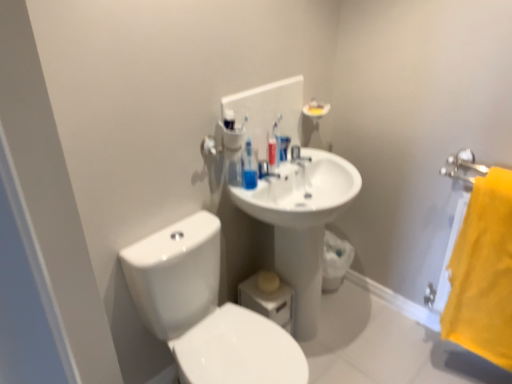
Question: Considering the relative sizes of yellow fabric towel at right and translucent plastic toothbrushes at upper center in the image provided, is yellow fabric towel at right bigger than translucent plastic toothbrushes at upper center?

Choices:
 (A) yes
 (B) no

Answer: (A)

Question: Is yellow fabric towel at right facing away from translucent plastic toothbrushes at upper center?

Choices:
 (A) yes
 (B) no

Answer: (B)

Question: Considering the relative sizes of yellow fabric towel at right and translucent plastic toothbrushes at upper center in the image provided, is yellow fabric towel at right wider than translucent plastic toothbrushes at upper center?

Choices:
 (A) yes
 (B) no

Answer: (A)

Question: Can you confirm if yellow fabric towel at right is shorter than translucent plastic toothbrushes at upper center?

Choices:
 (A) yes
 (B) no

Answer: (B)

Question: Considering the relative sizes of yellow fabric towel at right and translucent plastic toothbrushes at upper center in the image provided, is yellow fabric towel at right taller than translucent plastic toothbrushes at upper center?

Choices:
 (A) yes
 (B) no

Answer: (A)

Question: Is translucent plastic toothbrushes at upper center wider or thinner than white glossy sink at center?

Choices:
 (A) thin
 (B) wide

Answer: (A)

Question: In the image, is translucent plastic toothbrushes at upper center on the left side or the right side of white glossy sink at center?

Choices:
 (A) right
 (B) left

Answer: (B)

Question: From the image's perspective, relative to white glossy sink at center, is translucent plastic toothbrushes at upper center above or below?

Choices:
 (A) below
 (B) above

Answer: (A)

Question: Considering the positions of translucent plastic toothbrushes at upper center and white glossy sink at center in the image, is translucent plastic toothbrushes at upper center taller or shorter than white glossy sink at center?

Choices:
 (A) tall
 (B) short

Answer: (A)

Question: Is blue plastic mouthwash at center in front of or behind white glossy sink at center in the image?

Choices:
 (A) behind
 (B) front

Answer: (B)

Question: In terms of width, does blue plastic mouthwash at center look wider or thinner when compared to white glossy sink at center?

Choices:
 (A) thin
 (B) wide

Answer: (A)

Question: Is blue plastic mouthwash at center inside or outside of white glossy sink at center?

Choices:
 (A) outside
 (B) inside

Answer: (A)

Question: Is point (286, 147) closer or farther from the camera than point (302, 163)?

Choices:
 (A) closer
 (B) farther

Answer: (A)

Question: From their relative heights in the image, would you say white glossy sink at center is taller or shorter than translucent plastic toothbrushes at upper center?

Choices:
 (A) short
 (B) tall

Answer: (A)

Question: Is white glossy sink at center inside or outside of translucent plastic toothbrushes at upper center?

Choices:
 (A) outside
 (B) inside

Answer: (A)